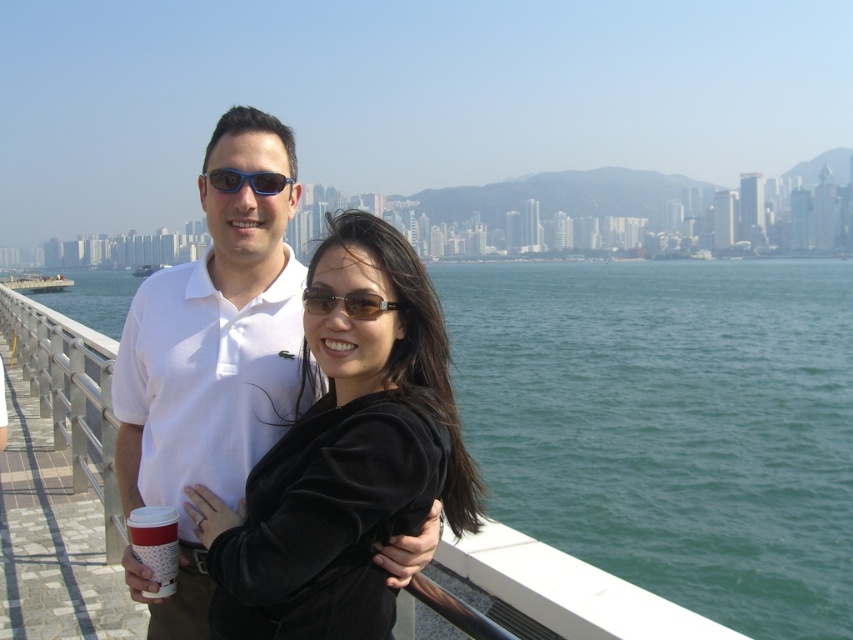
You are a photographer taking a picture of the green water at center and the white cotton polo shirt at center. Which object will occupy more space in the photo?

The green water at center will occupy more space in the photo because it has a larger size compared to the white cotton polo shirt at center.

You are a photographer standing on the bridge and want to take a photo of the brown matte sunglasses at center. The camera you have can only focus on objects within 3 meters. Will the sunglasses be in focus?

The brown matte sunglasses at center are 3.89 meters away, which is beyond the camera focus range of 3 meters. The sunglasses will not be in focus.

You are standing on a bridge overlooking water with a city skyline behind you. You see a couple nearby, the man in a white polo shirt and the woman in black, both smiling. There is a point marked at coordinates (671, 424). What is located at that point?

At point (671, 424) lies green water at center.